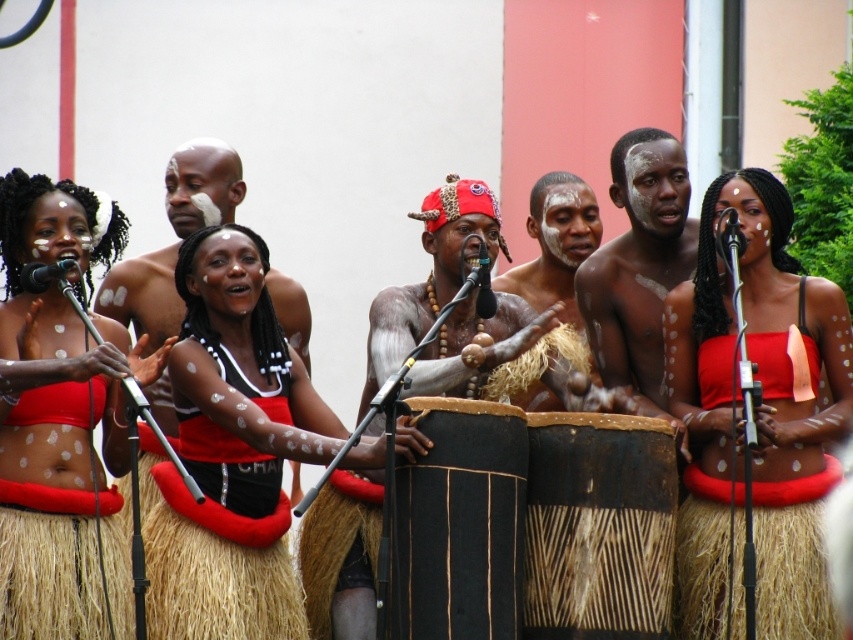
Question: Observing the image, what is the correct spatial positioning of matte red grass skirt at center in reference to black woven drum at center?

Choices:
 (A) below
 (B) above

Answer: (B)

Question: Which object appears farthest from the camera in this image?

Choices:
 (A) matte red skirt at center
 (B) black metallic microphone at upper center
 (C) matte skin man at center
 (D) shiny skin drum at center

Answer: (C)

Question: Which object is closer to the camera taking this photo?

Choices:
 (A) metallic black microphone at left
 (B) shiny skin drum at center

Answer: (A)

Question: Which of the following is the farthest from the observer?

Choices:
 (A) metallic black microphone at left
 (B) leather cap at center
 (C) matte skin man at center

Answer: (C)

Question: Does matte black dress at center appear under black metallic microphone at upper center?

Choices:
 (A) no
 (B) yes

Answer: (B)

Question: Does leather cap at center have a larger size compared to matte skin man at center?

Choices:
 (A) yes
 (B) no

Answer: (A)